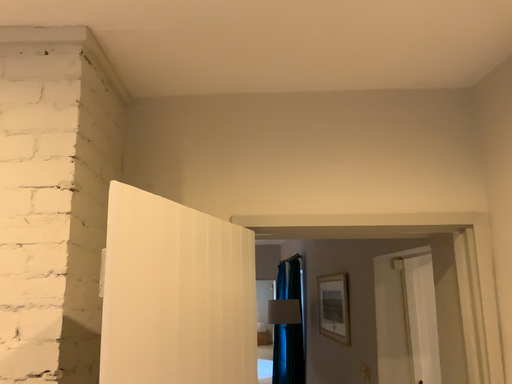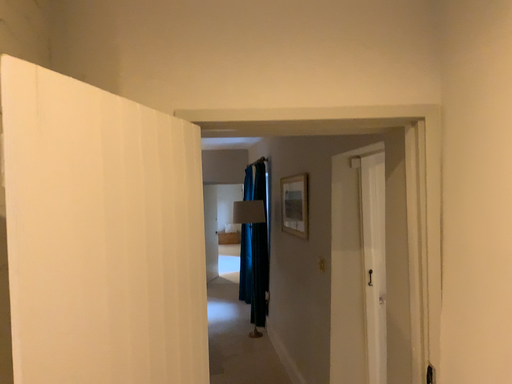
Question: How did the camera likely rotate when shooting the video?

Choices:
 (A) rotated downward
 (B) rotated upward

Answer: (A)